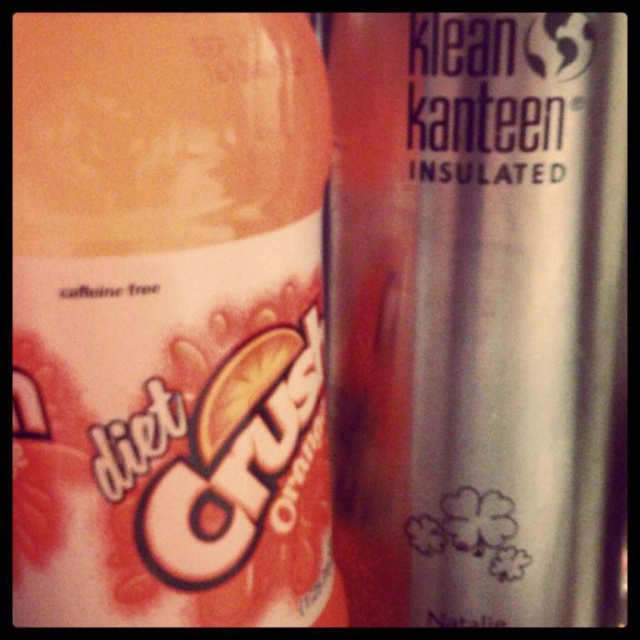
Is point (285, 449) farther from camera compared to point (476, 428)?

No, it is in front of (476, 428).

Is matte plastic bottle at center bigger than silver metallic water bottle at right?

Actually, matte plastic bottle at center might be smaller than silver metallic water bottle at right.

Which is behind, point (273, 516) or point (493, 285)?

The point (493, 285) is more distant.

Identify the location of matte plastic bottle at center. (170, 321).